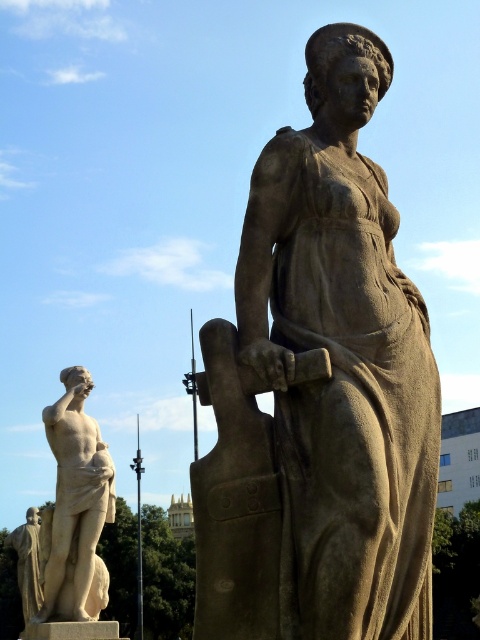
Question: Which of the following is the farthest from the observer?

Choices:
 (A) (45, 545)
 (B) (418, 323)

Answer: (A)

Question: Is matte stone statue at center wider than white marble statue at left?

Choices:
 (A) no
 (B) yes

Answer: (A)

Question: Among these objects, which one is nearest to the camera?

Choices:
 (A) white marble statue at left
 (B) matte stone statue at center

Answer: (B)

Question: Is matte stone statue at center further to the viewer compared to white marble statue at left?

Choices:
 (A) no
 (B) yes

Answer: (A)

Question: Is matte stone statue at center bigger than white marble statue at left?

Choices:
 (A) yes
 (B) no

Answer: (A)